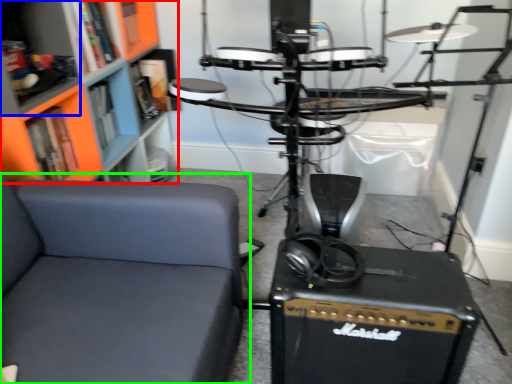
Question: Based on their relative distances, which object is farther from bookcase (highlighted by a red box)? Choose from shelf (highlighted by a blue box) and chair (highlighted by a green box).

Choices:
 (A) shelf
 (B) chair

Answer: (B)